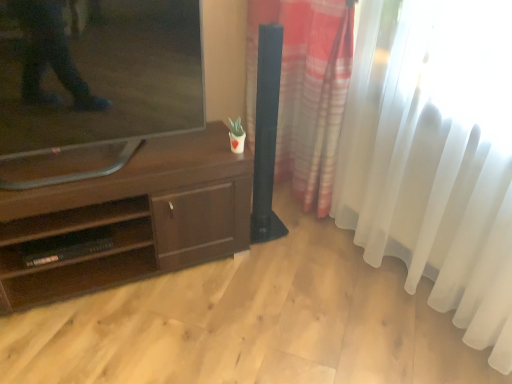
At what (x,y) coordinates should I click in order to perform the action: click on vacant space that's between dark brown wood tv stand at center and translucent fabric curtain at right. Please return your answer as a coordinate pair (x, y). Looking at the image, I should click on (278, 313).